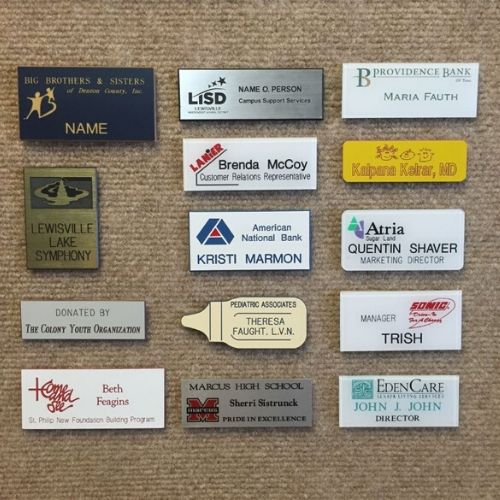
At what (x,y) coordinates should I click in order to perform the action: click on carpet. Please return your answer as a coordinate pair (x, y). This screenshot has width=500, height=500. Looking at the image, I should click on (261, 28).